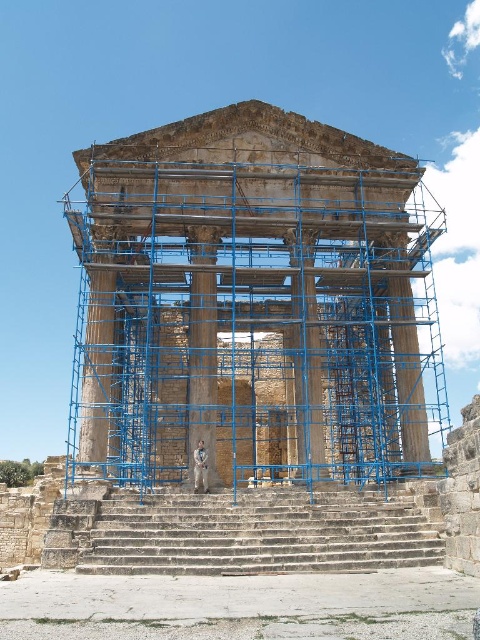
Is stone temple at center positioned in front of stone stairs at center?

No.

Looking at this image, is stone temple at center further to camera compared to stone stairs at center?

Yes, stone temple at center is further from the viewer.

Between point (374, 160) and point (223, 557), which one is positioned behind?

Positioned behind is point (374, 160).

The height and width of the screenshot is (640, 480). I want to click on stone temple at center, so click(252, 305).

In order to click on stone stairs at center in this screenshot , I will do point(260,532).

Is stone stairs at center closer to camera compared to smooth stone pillar at center?

Yes, stone stairs at center is in front of smooth stone pillar at center.

Who is more distant from viewer, (187, 522) or (199, 291)?

The point (199, 291) is more distant.

This screenshot has height=640, width=480. Find the location of `stone stairs at center`. stone stairs at center is located at coordinates (260, 532).

Consider the image. Is stone temple at center taller than smooth stone pillar at center?

Indeed, stone temple at center has a greater height compared to smooth stone pillar at center.

Identify the location of stone temple at center. 252,305.

You are a GUI agent. You are given a task and a screenshot of the screen. Output one action in this format:
    pyautogui.click(x=<x>, y=<y>)
    Task: Click on the stone temple at center
    The width and height of the screenshot is (480, 640).
    Given the screenshot: What is the action you would take?
    pyautogui.click(x=252, y=305)